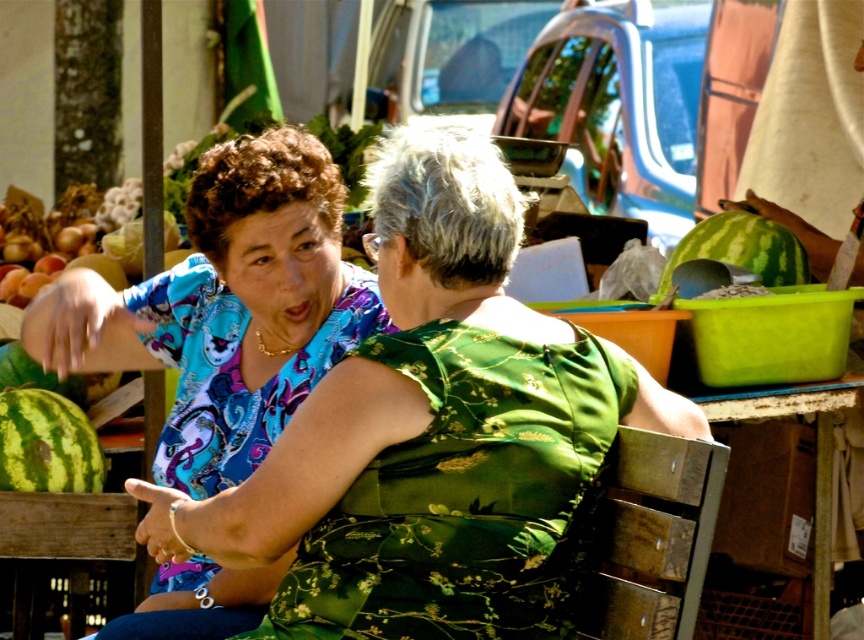
Question: Based on their relative distances, which object is farther from the green matte watermelon at lower left?

Choices:
 (A) blue paisley fabric dress at upper left
 (B) matte blue blouse at center
 (C) blue paisley blouse at upper left

Answer: (B)

Question: Considering the relative positions of green striped watermelon at lower left and green striped watermelon at right in the image provided, where is green striped watermelon at lower left located with respect to green striped watermelon at right?

Choices:
 (A) right
 (B) left

Answer: (B)

Question: Which object is farther from the camera taking this photo?

Choices:
 (A) matte blue blouse at center
 (B) green matte watermelon at lower left
 (C) blue paisley blouse at upper left
 (D) green striped watermelon at right

Answer: (B)

Question: Estimate the real-world distances between objects in this image. Which object is closer to the matte blue blouse at center?

Choices:
 (A) blue paisley blouse at upper left
 (B) green striped watermelon at lower left
 (C) blue paisley fabric dress at upper left
 (D) green striped watermelon at right

Answer: (A)

Question: Can you confirm if blue paisley fabric dress at upper left is smaller than green matte watermelon at lower left?

Choices:
 (A) yes
 (B) no

Answer: (B)

Question: Is blue paisley fabric dress at upper left to the right of green striped watermelon at lower left from the viewer's perspective?

Choices:
 (A) yes
 (B) no

Answer: (A)